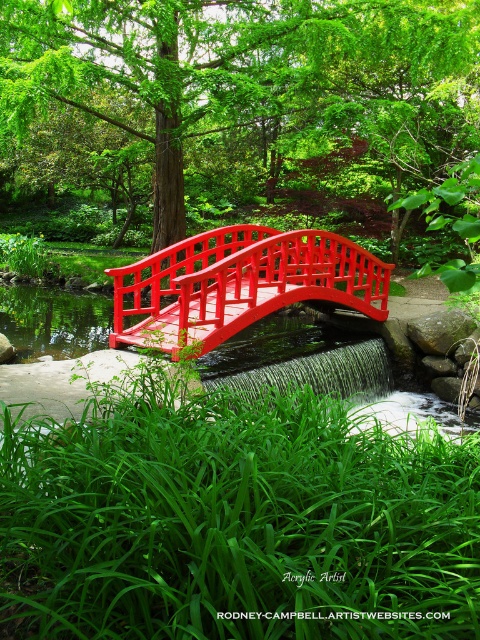
Question: Among these objects, which one is farthest from the camera?

Choices:
 (A) shiny red bridge at center
 (B) glossy wooden bridge at center

Answer: (A)

Question: Does glossy wooden bridge at center appear on the left side of shiny red bridge at center?

Choices:
 (A) no
 (B) yes

Answer: (B)

Question: Among these points, which one is nearest to the camera?

Choices:
 (A) (228, 230)
 (B) (313, 477)

Answer: (B)

Question: Does glossy wooden bridge at center have a smaller size compared to shiny red bridge at center?

Choices:
 (A) no
 (B) yes

Answer: (B)

Question: Considering the relative positions of glossy wooden bridge at center and shiny red bridge at center in the image provided, where is glossy wooden bridge at center located with respect to shiny red bridge at center?

Choices:
 (A) left
 (B) right

Answer: (A)

Question: Which object appears farthest from the camera in this image?

Choices:
 (A) shiny red bridge at center
 (B) glossy wooden bridge at center

Answer: (A)